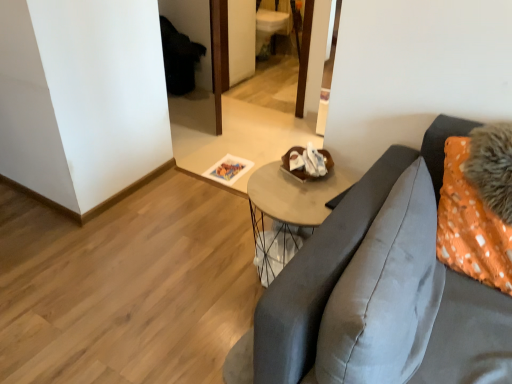
The image size is (512, 384). I want to click on satin gray pillow at right, so click(x=386, y=292).

From a real-world perspective, is wooden mirror at center located beneath wooden round table at center?

Actually, wooden mirror at center is physically above wooden round table at center in the real world.

Is wooden mirror at center looking in the opposite direction of wooden round table at center?

No, wooden mirror at center is not facing away from wooden round table at center.

Is wooden mirror at center in front of wooden round table at center?

No.

Considering the sizes of objects wooden mirror at center and satin gray pillow at right in the image provided, who is thinner, wooden mirror at center or satin gray pillow at right?

With smaller width is satin gray pillow at right.

Is wooden mirror at center bigger than satin gray pillow at right?

Correct, wooden mirror at center is larger in size than satin gray pillow at right.

Is wooden mirror at center oriented towards satin gray pillow at right?

No, wooden mirror at center is not facing towards satin gray pillow at right.

Does point (309, 26) come farther from viewer compared to point (351, 281)?

Yes, it is.

Based on the photo, is wooden round table at center to the right of wooden mirror at center from the viewer's perspective?

Correct, you'll find wooden round table at center to the right of wooden mirror at center.

Which of these two, wooden round table at center or wooden mirror at center, stands shorter?

Standing shorter between the two is wooden round table at center.

Who is bigger, wooden round table at center or satin gray pillow at right?

wooden round table at center.

Is wooden round table at center shorter than satin gray pillow at right?

Incorrect, the height of wooden round table at center does not fall short of that of satin gray pillow at right.

Could you tell me if wooden round table at center is turned towards satin gray pillow at right?

No, wooden round table at center is not turned towards satin gray pillow at right.

Which is behind, wooden round table at center or satin gray pillow at right?

wooden round table at center is further from the camera.

Looking at this image, is satin gray pillow at right further to the viewer compared to wooden round table at center?

No.

Is satin gray pillow at right to the right of wooden round table at center from the viewer's perspective?

Yes, satin gray pillow at right is to the right of wooden round table at center.

Image resolution: width=512 pixels, height=384 pixels. Identify the location of table that appears on the left of satin gray pillow at right. (288, 210).

Considering the sizes of satin gray pillow at right and wooden round table at center in the image, is satin gray pillow at right taller or shorter than wooden round table at center?

satin gray pillow at right is shorter than wooden round table at center.

Between point (335, 337) and point (194, 119), which one is positioned in front?

Positioned in front is point (335, 337).

Considering the sizes of satin gray pillow at right and wooden mirror at center in the image, is satin gray pillow at right taller or shorter than wooden mirror at center?

Considering their sizes, satin gray pillow at right has less height than wooden mirror at center.

Is satin gray pillow at right wider or thinner than wooden mirror at center?

Considering their sizes, satin gray pillow at right looks slimmer than wooden mirror at center.

Where is `mirror above the wooden round table at center (from a real-world perspective)`? This screenshot has width=512, height=384. mirror above the wooden round table at center (from a real-world perspective) is located at coordinates (253, 106).

You are a GUI agent. You are given a task and a screenshot of the screen. Output one action in this format:
    pyautogui.click(x=<x>, y=<y>)
    Task: Click on the mirror behind the satin gray pillow at right
    This screenshot has height=384, width=512.
    Given the screenshot: What is the action you would take?
    pyautogui.click(x=253, y=106)

Looking at the image, which one is located further to satin gray pillow at right, wooden mirror at center or wooden round table at center?

wooden mirror at center is further to satin gray pillow at right.

Which object lies further to the anchor point wooden mirror at center, satin gray pillow at right or wooden round table at center?

satin gray pillow at right is further to wooden mirror at center.

When comparing their distances from satin gray pillow at right, does wooden round table at center or wooden mirror at center seem closer?

The object closer to satin gray pillow at right is wooden round table at center.

Estimate the real-world distances between objects in this image. Which object is closer to wooden mirror at center, wooden round table at center or satin gray pillow at right?

wooden round table at center is closer to wooden mirror at center.

Estimate the real-world distances between objects in this image. Which object is closer to wooden round table at center, wooden mirror at center or satin gray pillow at right?

satin gray pillow at right lies closer to wooden round table at center than the other object.

Based on their spatial positions, is satin gray pillow at right or wooden mirror at center further from wooden round table at center?

wooden mirror at center is further to wooden round table at center.

Where is `table located between satin gray pillow at right and wooden mirror at center in the depth direction`? This screenshot has height=384, width=512. table located between satin gray pillow at right and wooden mirror at center in the depth direction is located at coordinates (288, 210).